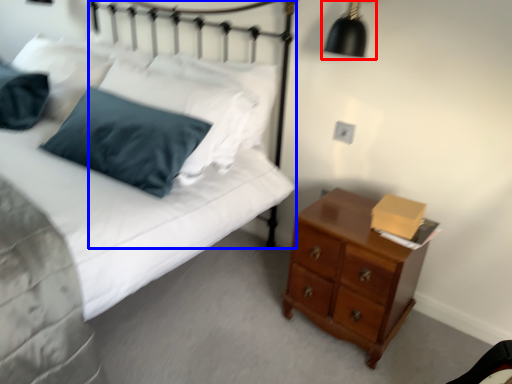
Question: Among these objects, which one is nearest to the camera, lamp (highlighted by a red box) or headboard (highlighted by a blue box)?

Choices:
 (A) lamp
 (B) headboard

Answer: (A)